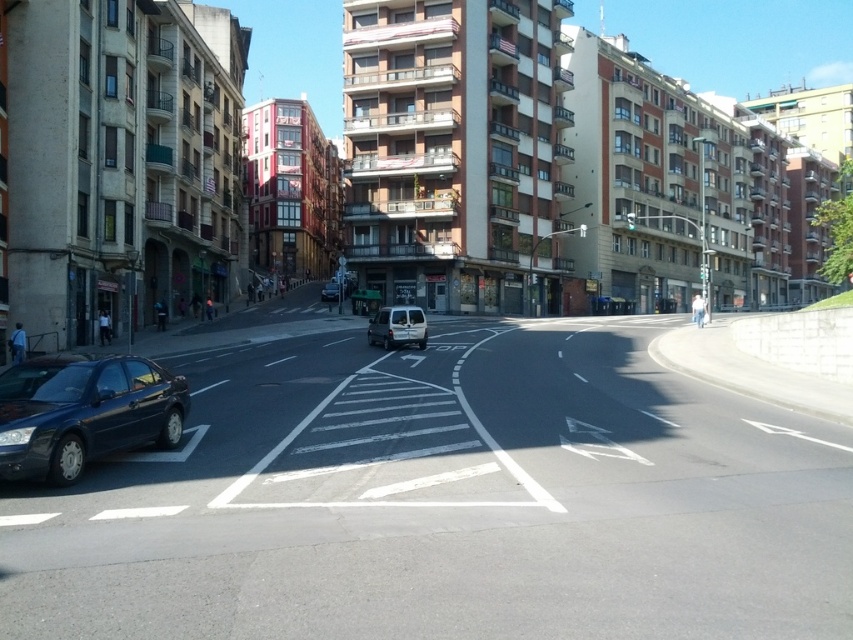
Who is more distant from viewer, (93, 388) or (334, 284)?

The point (334, 284) is behind.

Does matte black car at lower left have a larger size compared to matte silver van at center?

No, matte black car at lower left is not bigger than matte silver van at center.

The image size is (853, 640). Describe the element at coordinates (84, 412) in the screenshot. I see `matte black car at lower left` at that location.

Locate an element on the screen. The image size is (853, 640). matte black car at lower left is located at coordinates (84, 412).

Is satin silver van at center further to camera compared to matte silver van at center?

No, satin silver van at center is closer to the viewer.

Find the location of a particular element. The width and height of the screenshot is (853, 640). satin silver van at center is located at coordinates (397, 326).

What do you see at coordinates (84, 412) in the screenshot? Image resolution: width=853 pixels, height=640 pixels. I see `matte black car at lower left` at bounding box center [84, 412].

Who is shorter, matte black car at lower left or satin silver van at center?

With less height is matte black car at lower left.

From the picture: Who is more distant from viewer, (6, 444) or (376, 317)?

The point (376, 317) is behind.

Identify the location of matte black car at lower left. The image size is (853, 640). (84, 412).